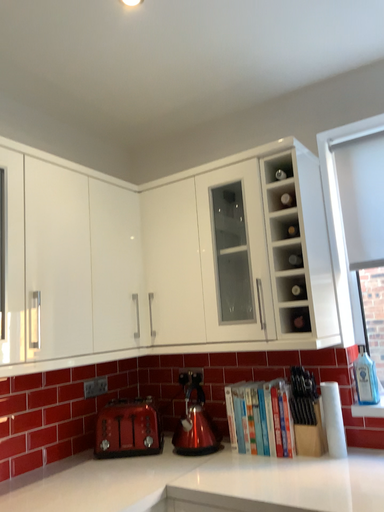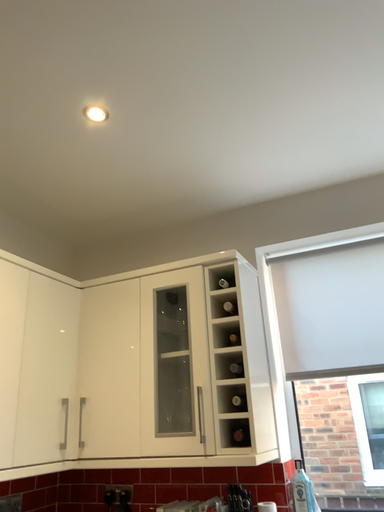
Question: Which way did the camera rotate in the video?

Choices:
 (A) rotated right
 (B) rotated left

Answer: (A)